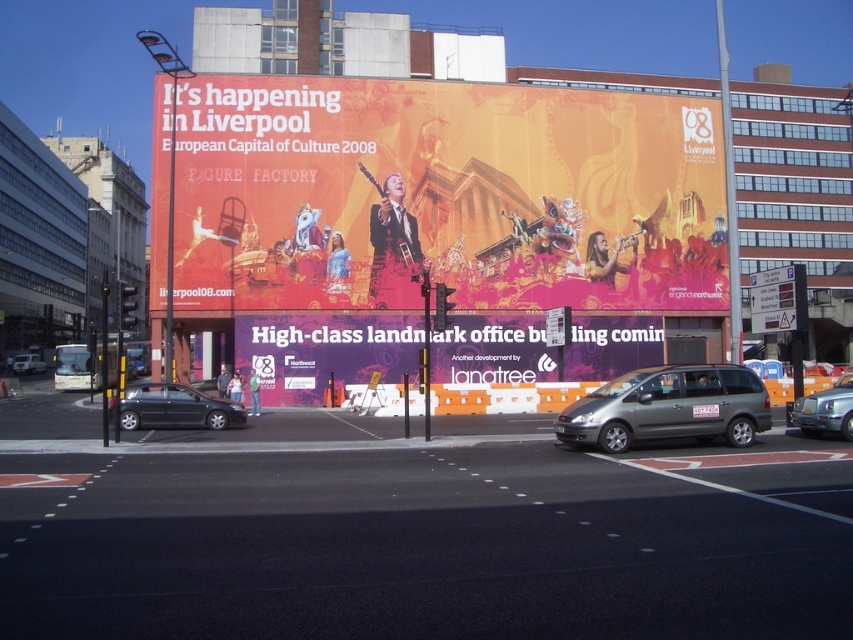
Who is positioned more to the right, orange matte billboard at upper center or matte black car at lower left?

orange matte billboard at upper center is more to the right.

Who is more distant from viewer, (502, 211) or (154, 404)?

The point (502, 211) is behind.

Between point (682, 280) and point (140, 413), which one is positioned behind?

The point (682, 280) is behind.

Find the location of a particular element. The width and height of the screenshot is (853, 640). orange matte billboard at upper center is located at coordinates (445, 196).

Which of these two, purple matte sign at center or metallic silver car at center, stands shorter?

Standing shorter between the two is metallic silver car at center.

Is purple matte sign at center positioned behind metallic silver car at center?

Yes, purple matte sign at center is further from the viewer.

In order to click on purple matte sign at center in this screenshot , I will do click(325, 352).

Based on the photo, between orange matte billboard at upper center and silver metallic car at lower left, which one appears on the left side from the viewer's perspective?

Positioned to the left is silver metallic car at lower left.

Where is `orange matte billboard at upper center`? The width and height of the screenshot is (853, 640). orange matte billboard at upper center is located at coordinates (445, 196).

This screenshot has height=640, width=853. I want to click on orange matte billboard at upper center, so click(x=445, y=196).

Find the location of a particular element. The image size is (853, 640). orange matte billboard at upper center is located at coordinates (445, 196).